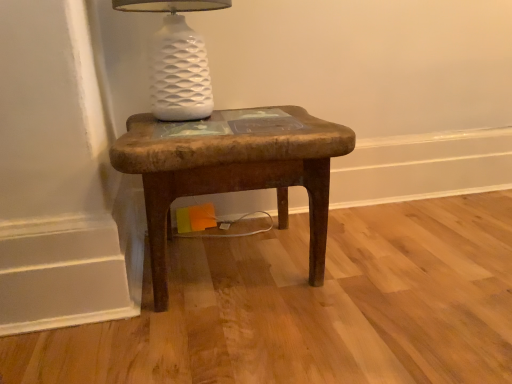
Find the location of `spots to the right of white ceramic lamp at upper center`. spots to the right of white ceramic lamp at upper center is located at coordinates (276, 119).